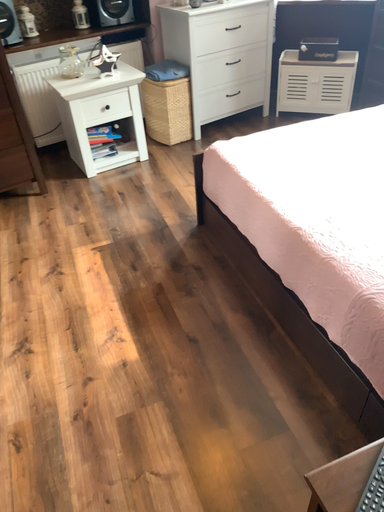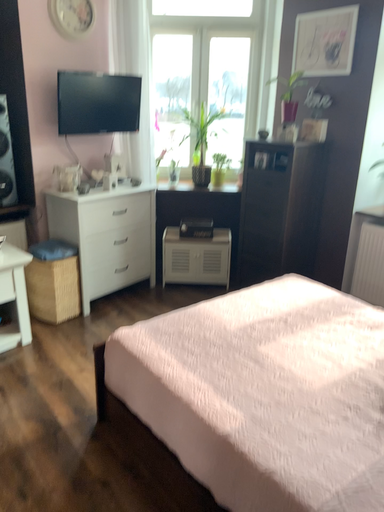
Question: How did the camera likely rotate when shooting the video?

Choices:
 (A) rotated downward
 (B) rotated upward

Answer: (B)